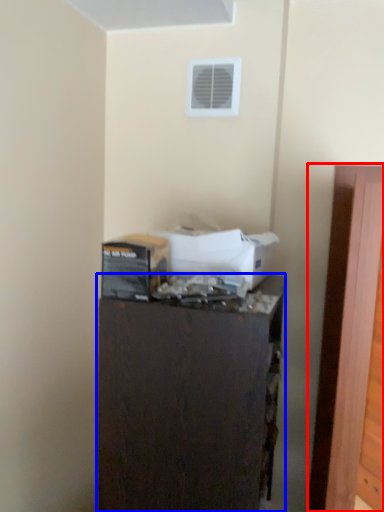
Question: Which object is further to the camera taking this photo, door (highlighted by a red box) or furniture (highlighted by a blue box)?

Choices:
 (A) door
 (B) furniture

Answer: (B)